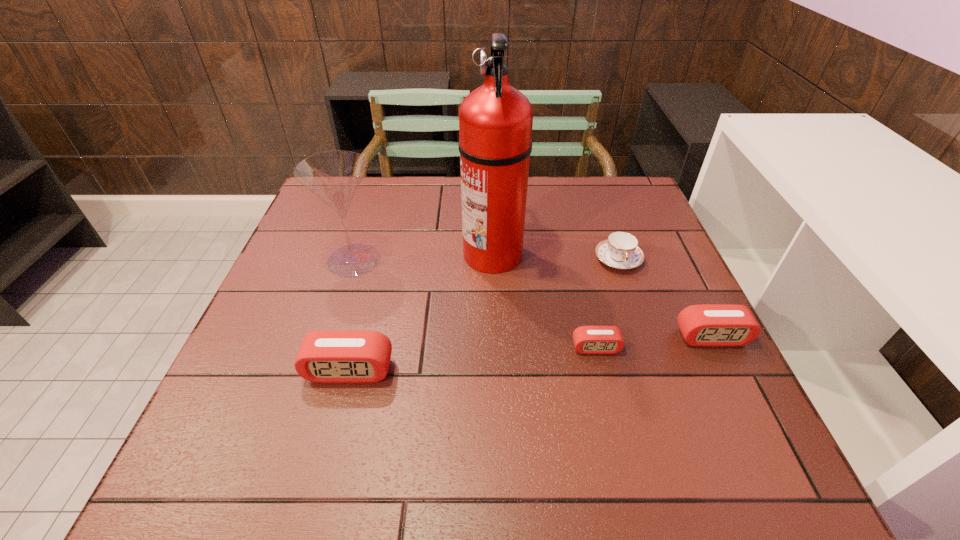
Locate an element on the screen. This screenshot has height=540, width=960. the leftmost alarm clock is located at coordinates (334, 356).

Identify the location of the nearest object. (334, 356).

At what (x,y) coordinates should I click in order to perform the action: click on the shortest alarm clock. Please return your answer as a coordinate pair (x, y). Looking at the image, I should click on (587, 339).

Find the location of a particular element. Image resolution: width=960 pixels, height=540 pixels. the second alarm clock from right to left is located at coordinates (587, 339).

Identify the location of the second tallest alarm clock. The height and width of the screenshot is (540, 960). 716,325.

This screenshot has height=540, width=960. In order to click on the fourth tallest object in this screenshot , I will do `click(716, 325)`.

Where is `fire extinguisher`? fire extinguisher is located at coordinates (495, 120).

Find the location of a particular element. Image resolution: width=960 pixels, height=540 pixels. the tallest object is located at coordinates tap(495, 120).

Locate an element on the screen. The width and height of the screenshot is (960, 540). the fifth shortest object is located at coordinates (334, 176).

At what (x,y) coordinates should I click in order to perform the action: click on teacup. Please return your answer as a coordinate pair (x, y). Looking at the image, I should click on (621, 251).